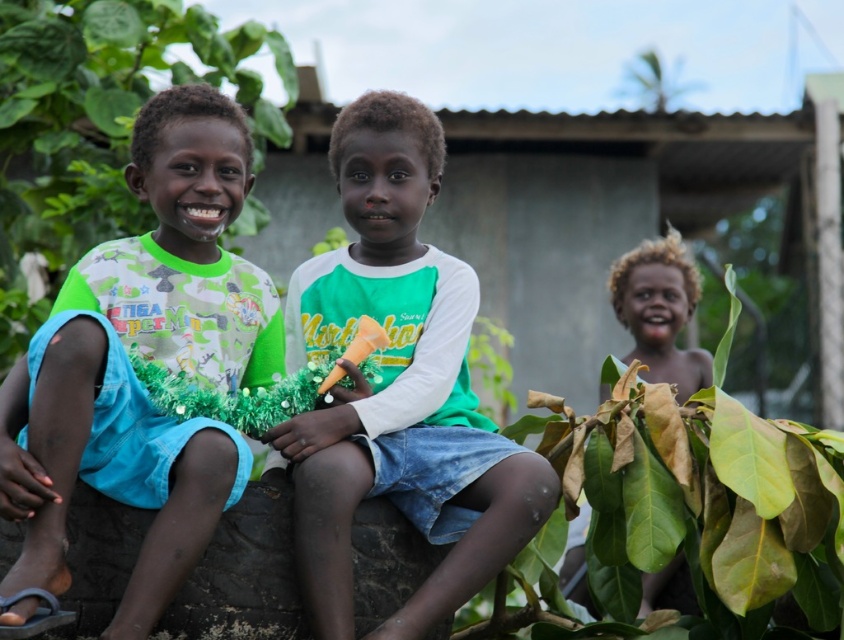
Between green leafy plant at right and light brown hair at lower right, which one is positioned lower?

Positioned lower is green leafy plant at right.

Does point (528, 557) come in front of point (683, 298)?

Yes, point (528, 557) is closer to viewer.

The height and width of the screenshot is (640, 844). Find the location of `green leafy plant at right`. green leafy plant at right is located at coordinates (685, 504).

Is point (25, 333) closer to viewer compared to point (626, 273)?

Yes, it is.

Identify the location of green leafy plant at left. The width and height of the screenshot is (844, 640). (96, 124).

Does point (262, 45) lie in front of point (647, 314)?

That is True.

Locate an element on the screen. The image size is (844, 640). green leafy plant at left is located at coordinates (96, 124).

Is matte green t-shirt at left to the right of green leafy plant at left from the viewer's perspective?

Correct, you'll find matte green t-shirt at left to the right of green leafy plant at left.

Locate an element on the screen. The height and width of the screenshot is (640, 844). matte green t-shirt at left is located at coordinates (133, 371).